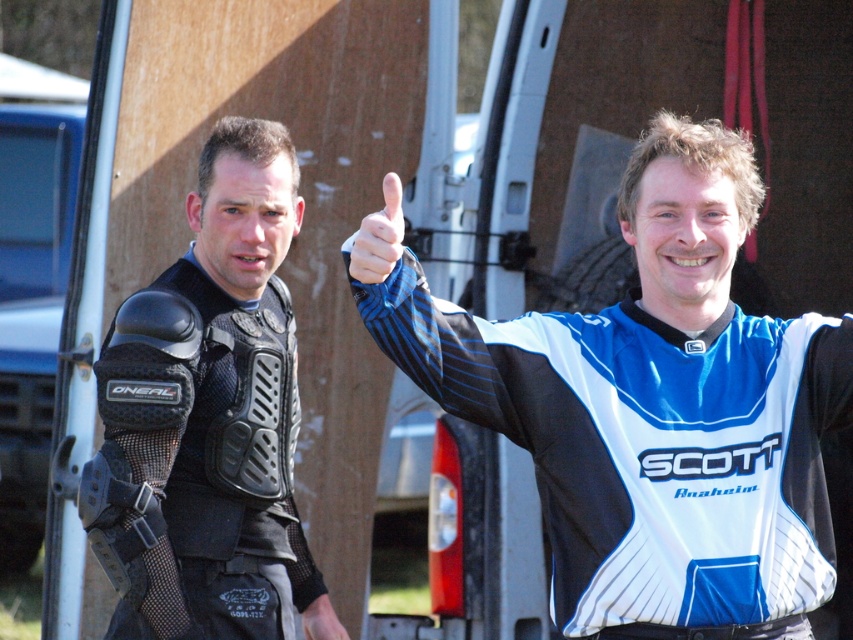
You are a photographer trying to capture a photo of the black mesh vest at left. The camera you are using has a limited field of view. Given that the black mesh vest at left is represented by point (207, 416), can you estimate whether the vest will be visible in the photo if the camera is focused on the center of the image?

The black mesh vest at left is represented by point (207, 416), which is located near the right side of the image. Since the camera is focused on the center, the vest might be partially visible but not centered in the photo.